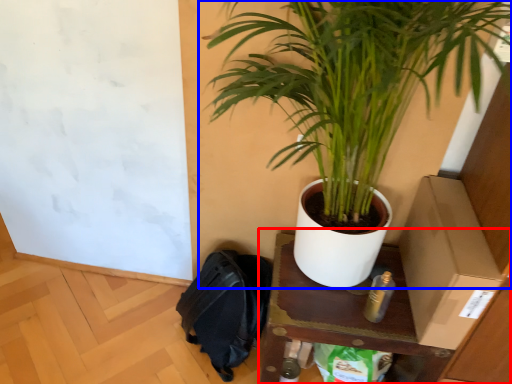
Question: Among these objects, which one is nearest to the camera, table (highlighted by a red box) or houseplant (highlighted by a blue box)?

Choices:
 (A) table
 (B) houseplant

Answer: (B)